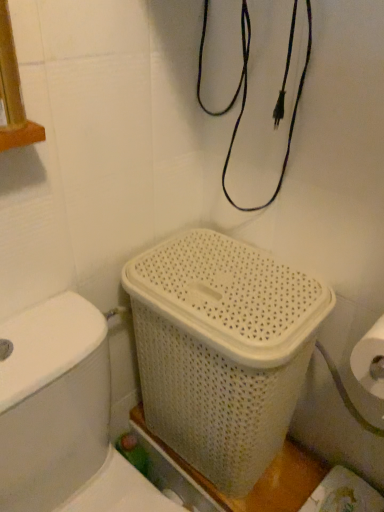
Locate an element on the screen. This screenshot has width=384, height=512. vacant space situated above white woven basket at center (from a real-world perspective) is located at coordinates (221, 286).